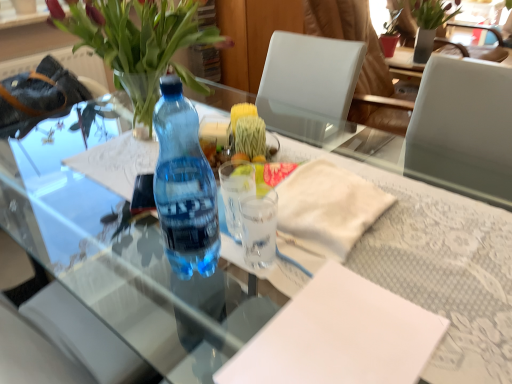
The height and width of the screenshot is (384, 512). What are the coordinates of `spots to the right of white paper at center, the 2th notepad when ordered from top to bottom` in the screenshot? It's located at (459, 303).